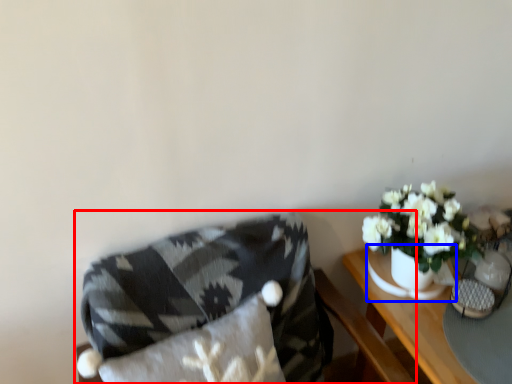
Question: Among these objects, which one is nearest to the camera, chair (highlighted by a red box) or vase (highlighted by a blue box)?

Choices:
 (A) chair
 (B) vase

Answer: (A)